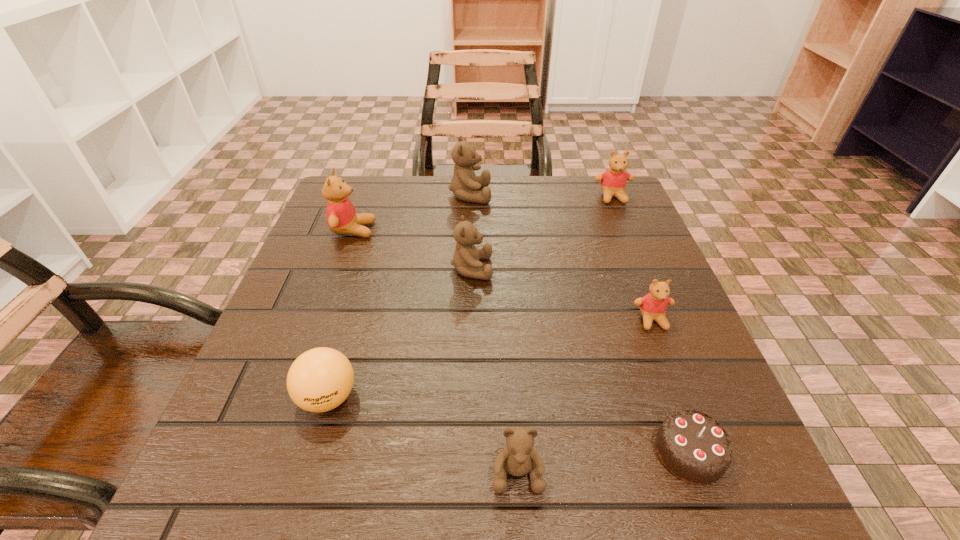
You are a GUI agent. You are given a task and a screenshot of the screen. Output one action in this format:
    pyautogui.click(x=<x>, y=<y>)
    Task: Click on the teddy bear present at the near edge
    Image resolution: width=960 pixels, height=540 pixels.
    Given the screenshot: What is the action you would take?
    pyautogui.click(x=518, y=458)

This screenshot has height=540, width=960. Identify the location of chocolate cake that is at the near edge. (693, 446).

This screenshot has width=960, height=540. In order to click on teddy bear that is at the left edge in this screenshot , I will do `click(341, 216)`.

Find the location of `ping-pong ball present at the left edge`. ping-pong ball present at the left edge is located at coordinates (319, 380).

This screenshot has height=540, width=960. What are the coordinates of `chocolate cake at the right edge` in the screenshot? It's located at (693, 446).

Where is `object that is positioned at the far left corner`? Image resolution: width=960 pixels, height=540 pixels. object that is positioned at the far left corner is located at coordinates (341, 216).

In order to click on object located at the far right corner in this screenshot , I will do `click(613, 181)`.

Locate an element on the screen. The height and width of the screenshot is (540, 960). object present at the near right corner is located at coordinates (693, 446).

Where is `vacant space at the far edge`? vacant space at the far edge is located at coordinates (404, 185).

In the image, there is a desktop. Find the location of `vacant space at the near edge`. vacant space at the near edge is located at coordinates (564, 478).